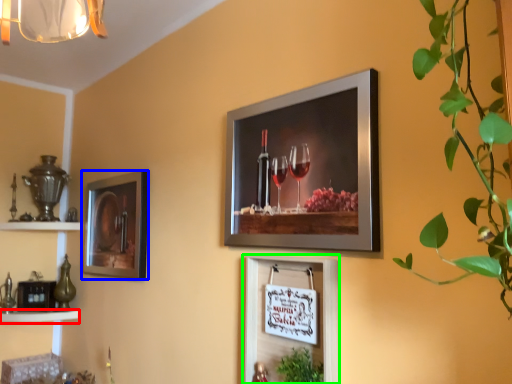
Question: Which is farther away from shelf (highlighted by a red box)? picture frame (highlighted by a blue box) or picture frame (highlighted by a green box)?

Choices:
 (A) picture frame
 (B) picture frame

Answer: (B)